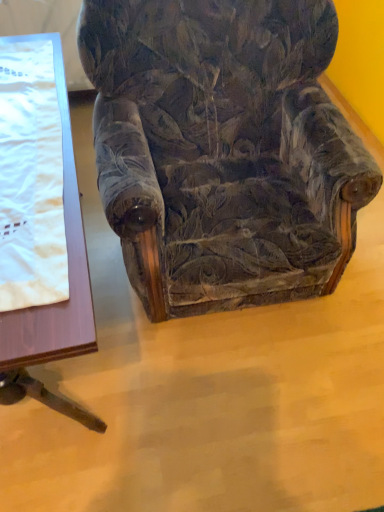
Question: Is wooden table at left to the left or to the right of white satin blanket at left in the image?

Choices:
 (A) left
 (B) right

Answer: (A)

Question: Considering the positions of wooden table at left and white satin blanket at left in the image, is wooden table at left wider or thinner than white satin blanket at left?

Choices:
 (A) wide
 (B) thin

Answer: (A)

Question: Which is farther from the wooden table at left?

Choices:
 (A) velvet floral-patterned armchair at center
 (B) white satin blanket at left

Answer: (A)

Question: Considering the real-world distances, which object is closest to the wooden table at left?

Choices:
 (A) white satin blanket at left
 (B) velvet floral-patterned armchair at center

Answer: (A)